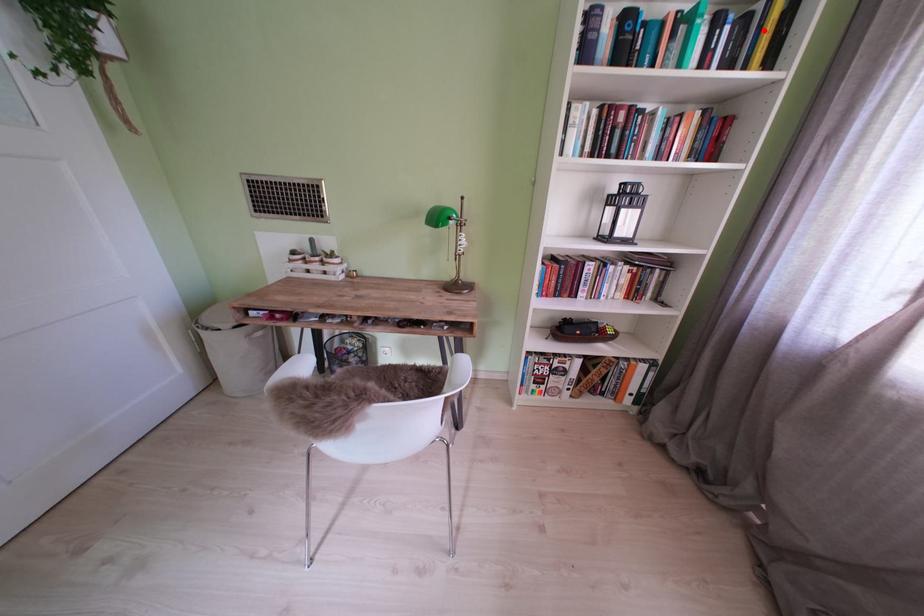
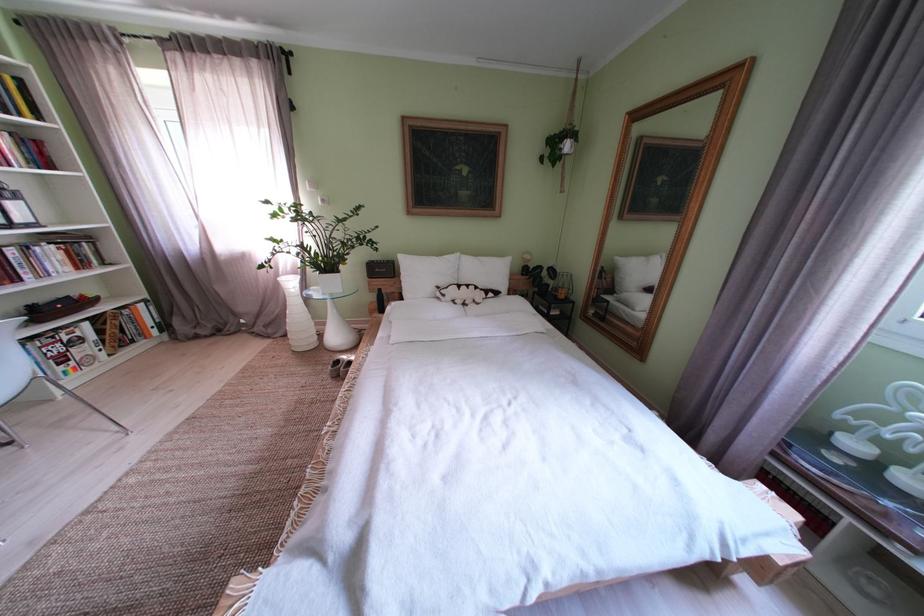
The point at the highlighted location is marked in the first image. Where is the corresponding point in the second image?

(9, 92)